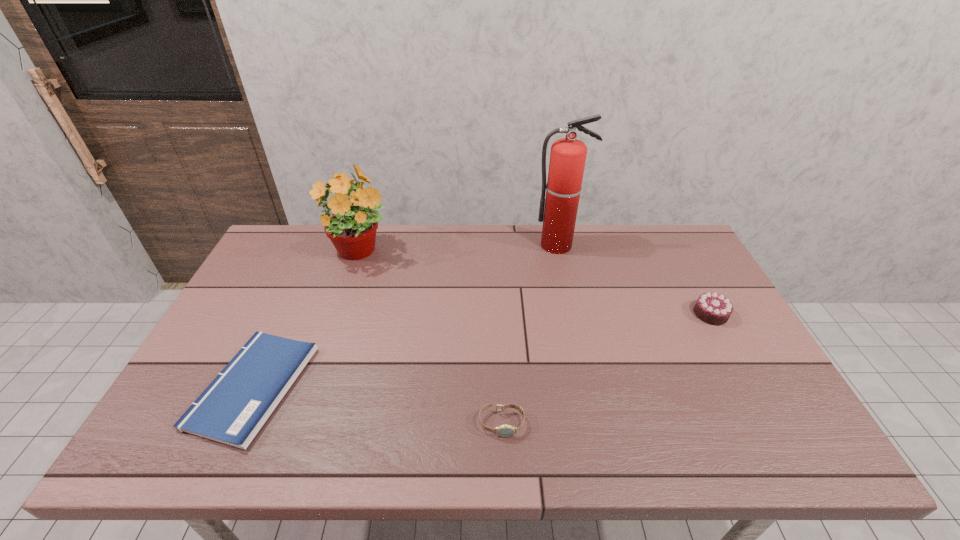
At what (x,y) coordinates should I click in order to perform the action: click on the second object from right to left. Please return your answer as a coordinate pair (x, y). The height and width of the screenshot is (540, 960). Looking at the image, I should click on (568, 155).

Locate an element on the screen. The height and width of the screenshot is (540, 960). the tallest object is located at coordinates (568, 155).

Where is `flowerpot`? The width and height of the screenshot is (960, 540). flowerpot is located at coordinates click(350, 222).

Where is `the rightmost object`? This screenshot has height=540, width=960. the rightmost object is located at coordinates (712, 308).

Find the location of `chocolate cake`. chocolate cake is located at coordinates (712, 308).

The image size is (960, 540). I want to click on the third object from right to left, so click(505, 430).

Find the location of `watch`. watch is located at coordinates (505, 430).

Locate an element on the screen. The image size is (960, 540). paperback book is located at coordinates click(x=233, y=408).

Locate an element on the screen. Image resolution: width=960 pixels, height=540 pixels. vacant space located 0.130m with the nozzle and gauge on the second object from right to left is located at coordinates (565, 280).

Find the location of a particular element. vacant space situated on the right of the flowerpot is located at coordinates (462, 253).